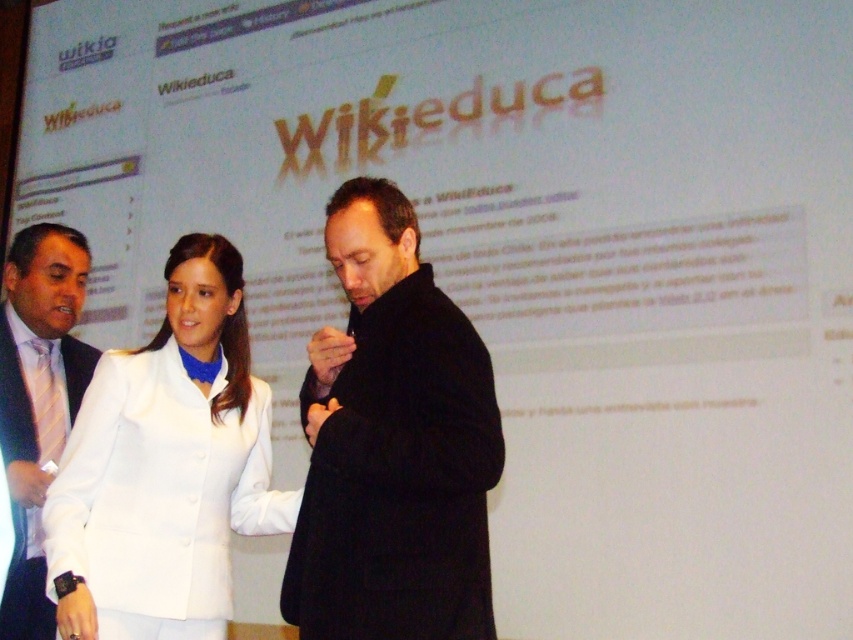
Can you confirm if white fabric jacket at center is bigger than white shirt at left?

Correct, white fabric jacket at center is larger in size than white shirt at left.

Between white fabric jacket at center and white shirt at left, which one is positioned higher?

white fabric jacket at center

Does point (193, 564) come behind point (57, 324)?

That is False.

The width and height of the screenshot is (853, 640). Find the location of `white fabric jacket at center`. white fabric jacket at center is located at coordinates (166, 465).

Consider the image. Between black wool coat at center and white shirt at left, which one has more height?

With more height is white shirt at left.

Can you confirm if black wool coat at center is positioned to the left of white shirt at left?

No, black wool coat at center is not to the left of white shirt at left.

You are a GUI agent. You are given a task and a screenshot of the screen. Output one action in this format:
    pyautogui.click(x=<x>, y=<y>)
    Task: Click on the black wool coat at center
    The width and height of the screenshot is (853, 640).
    Given the screenshot: What is the action you would take?
    pyautogui.click(x=392, y=444)

Can you confirm if black wool coat at center is wider than white fabric jacket at center?

No, black wool coat at center is not wider than white fabric jacket at center.

Measure the distance between point (285, 577) and camera.

7.16 feet

I want to click on black wool coat at center, so click(392, 444).